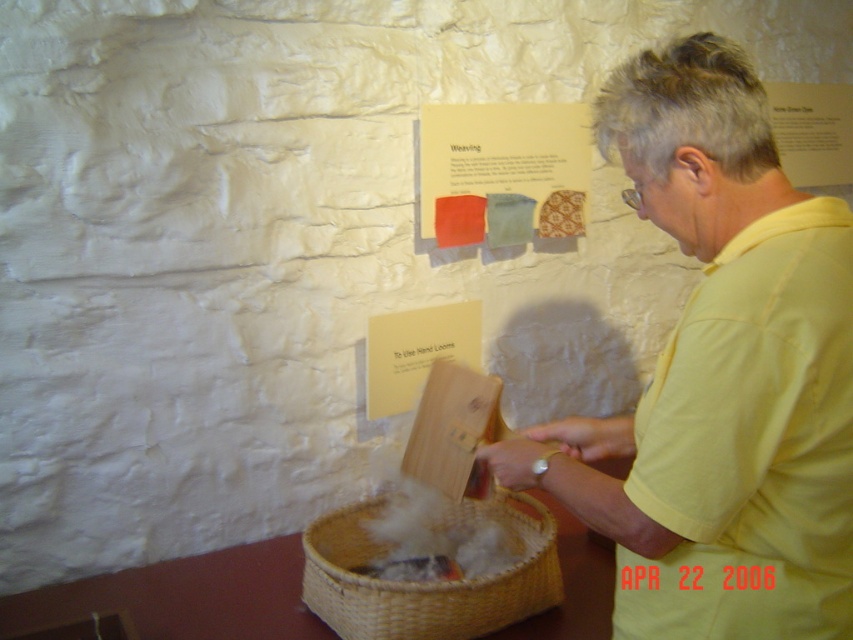
You are a photographer trying to capture the woven straw basket at lower center without the yellow cotton shirt at center blocking it. How can you adjust your position to achieve this?

Since the yellow cotton shirt at center is in front of the woven straw basket at lower center, you can move your camera position to the side or angle it so that the shirt is no longer blocking the basket.

Consider the image. What is located at the coordinates point (502, 172) in the image?

The point (502, 172) corresponds to the matte paper poster at upper center.

You are a visitor at a weaving workshop and see a person wearing a yellow cotton shirt at center and holding a woven straw basket at lower center. Which item is located to the right of the other?

The yellow cotton shirt at center is positioned on the right side of woven straw basket at lower center, so the shirt is to the right of the basket.